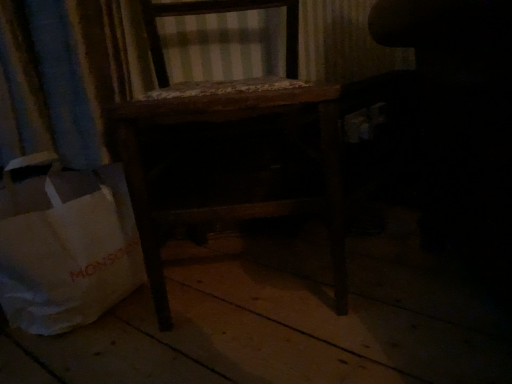
Measure the distance between dark fabric swivel chair at right and camera.

16.28 inches.

Locate an element on the screen. The image size is (512, 384). dark fabric swivel chair at right is located at coordinates (463, 107).

The image size is (512, 384). Find the location of `white paper bag at lower left`. white paper bag at lower left is located at coordinates (65, 246).

I want to click on dark fabric swivel chair at right, so click(x=463, y=107).

From their relative heights in the image, would you say dark fabric swivel chair at right is taller or shorter than wooden chair at center?

In the image, dark fabric swivel chair at right appears to be shorter than wooden chair at center.

Considering the relative sizes of dark fabric swivel chair at right and wooden chair at center in the image provided, is dark fabric swivel chair at right wider than wooden chair at center?

No, dark fabric swivel chair at right is not wider than wooden chair at center.

From a real-world perspective, is dark fabric swivel chair at right positioned under wooden chair at center based on gravity?

No, from a real-world perspective, dark fabric swivel chair at right is not under wooden chair at center.

Is dark fabric swivel chair at right situated inside wooden chair at center or outside?

dark fabric swivel chair at right exists outside the volume of wooden chair at center.

Find the location of a particular element. grocery bag behind the wooden chair at center is located at coordinates (65, 246).

From a real-world perspective, between wooden chair at center and white paper bag at lower left, who is vertically higher?

From a 3D spatial view, wooden chair at center is above.

Consider the image. How many degrees apart are the facing directions of wooden chair at center and white paper bag at lower left?

The facing directions of wooden chair at center and white paper bag at lower left are 11.5 degrees apart.

From the image's perspective, is wooden chair at center located above white paper bag at lower left?

Yes, from the image's perspective, wooden chair at center is over white paper bag at lower left.

Considering their positions, is wooden chair at center located in front of or behind dark fabric swivel chair at right?

wooden chair at center is in front of dark fabric swivel chair at right.

Is wooden chair at center with dark fabric swivel chair at right?

No, wooden chair at center is not touching dark fabric swivel chair at right.

From a real-world perspective, which is physically above, wooden chair at center or dark fabric swivel chair at right?

In real-world perspective, dark fabric swivel chair at right is above.

Is wooden chair at center not inside dark fabric swivel chair at right?

Yes.

Can you tell me how much white paper bag at lower left and dark fabric swivel chair at right differ in facing direction?

There is a 10.6-degree angle between the facing directions of white paper bag at lower left and dark fabric swivel chair at right.

Does white paper bag at lower left have a greater width compared to dark fabric swivel chair at right?

No, white paper bag at lower left is not wider than dark fabric swivel chair at right.

From the image's perspective, which is above, white paper bag at lower left or dark fabric swivel chair at right?

dark fabric swivel chair at right appears higher in the image.

Between white paper bag at lower left and dark fabric swivel chair at right, which one appears on the left side from the viewer's perspective?

white paper bag at lower left.

Which is farther from the camera, (456,36) or (32,161)?

The point (32,161) is behind.

From the image's perspective, is dark fabric swivel chair at right located beneath white paper bag at lower left?

Actually, dark fabric swivel chair at right appears above white paper bag at lower left in the image.

Based on their positions, is dark fabric swivel chair at right located to the left or right of white paper bag at lower left?

From the image, it's evident that dark fabric swivel chair at right is to the right of white paper bag at lower left.

How different are the orientations of dark fabric swivel chair at right and white paper bag at lower left in degrees?

There is a 10.6-degree angle between the facing directions of dark fabric swivel chair at right and white paper bag at lower left.

Is the surface of white paper bag at lower left in direct contact with wooden chair at center?

They are not placed beside each other.

From the image's perspective, is white paper bag at lower left located beneath wooden chair at center?

Yes, from the image's perspective, white paper bag at lower left is below wooden chair at center.

Consider the image. From a real-world perspective, which is physically above, white paper bag at lower left or wooden chair at center?

In real-world perspective, wooden chair at center is above.

At what (x,y) coordinates should I click in order to perform the action: click on swivel chair located above the wooden chair at center (from a real-world perspective). Please return your answer as a coordinate pair (x, y). Looking at the image, I should click on (463, 107).

I want to click on grocery bag below the wooden chair at center (from the image's perspective), so click(65, 246).

From the image, which object appears to be farther from dark fabric swivel chair at right, wooden chair at center or white paper bag at lower left?

white paper bag at lower left lies further to dark fabric swivel chair at right than the other object.

From the picture: When comparing their distances from white paper bag at lower left, does wooden chair at center or dark fabric swivel chair at right seem further?

The object further to white paper bag at lower left is dark fabric swivel chair at right.

From the image, which object appears to be nearer to white paper bag at lower left, dark fabric swivel chair at right or wooden chair at center?

wooden chair at center is closer to white paper bag at lower left.

Consider the image. Looking at the image, which one is located further to wooden chair at center, dark fabric swivel chair at right or white paper bag at lower left?

dark fabric swivel chair at right is positioned further to the anchor wooden chair at center.

From the picture: Looking at the image, which one is located closer to dark fabric swivel chair at right, white paper bag at lower left or wooden chair at center?

wooden chair at center is positioned closer to the anchor dark fabric swivel chair at right.

Consider the image. From the image, which object appears to be farther from wooden chair at center, white paper bag at lower left or dark fabric swivel chair at right?

The object further to wooden chair at center is dark fabric swivel chair at right.

The width and height of the screenshot is (512, 384). I want to click on furniture situated between white paper bag at lower left and dark fabric swivel chair at right from left to right, so coord(231,204).